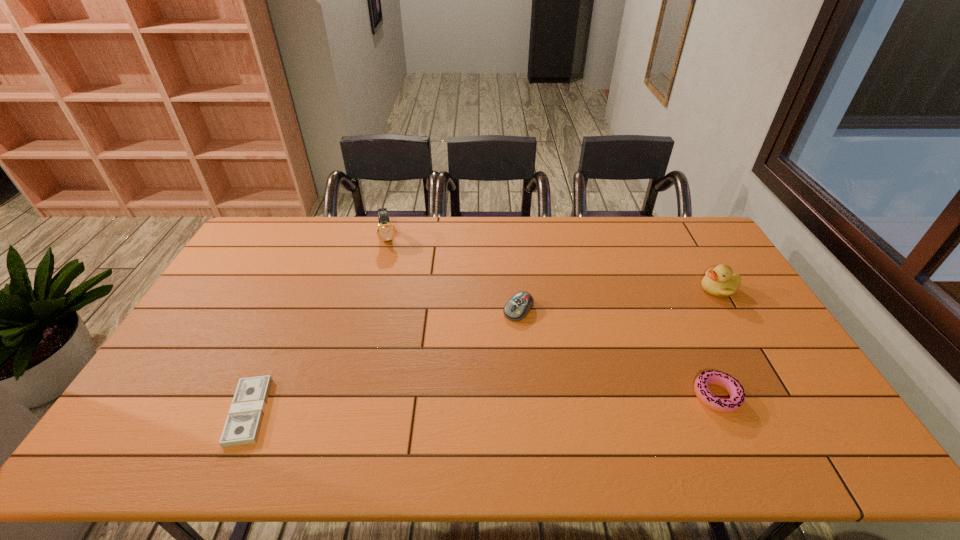
Find the location of a particular element. The image size is (960, 540). free space on the desktop that is between the dollar and the fourth object from left to right and is positioned on the beak of the second tallest object is located at coordinates (548, 402).

Locate an element on the screen. The height and width of the screenshot is (540, 960). free space on the desktop that is between the dollar and the doughnut and is positioned on the wheel side of the computer mouse is located at coordinates (439, 406).

I want to click on vacant space on the desktop that is between the shortest object and the second object from right to left and is positioned on the face of the watch, so click(x=420, y=406).